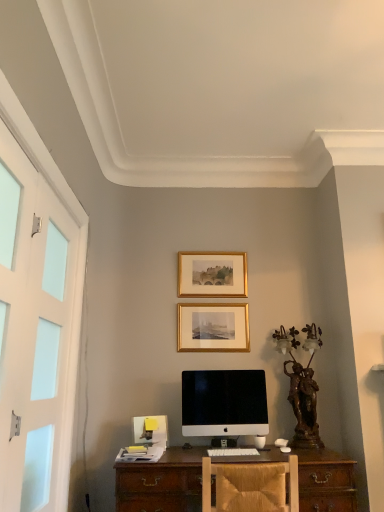
Locate an element on the screen. The width and height of the screenshot is (384, 512). vacant area situated below gold/gilded picture frame at upper center, positioned as the second picture frame in bottom-to-top order (from a real-world perspective) is located at coordinates (220, 297).